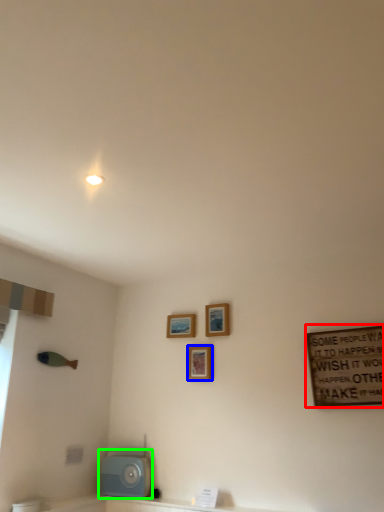
Question: Which is nearer to the bulletin board (highlighted by a red box)? picture frame (highlighted by a blue box) or appliance (highlighted by a green box).

Choices:
 (A) picture frame
 (B) appliance

Answer: (A)